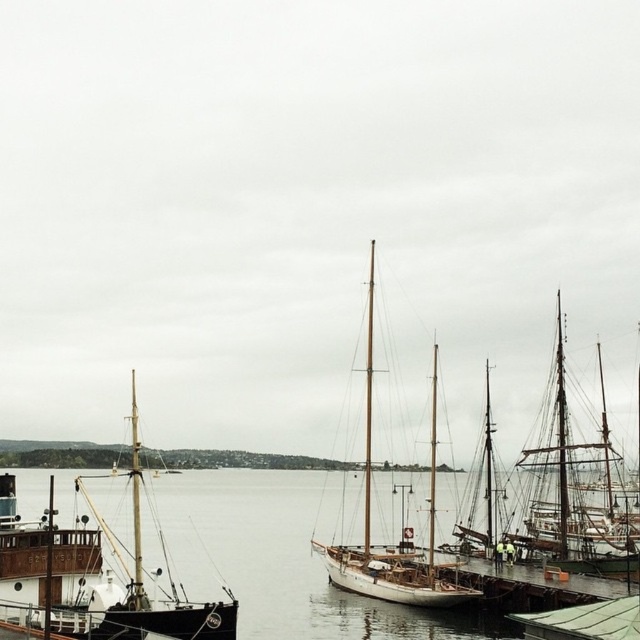
Question: Does clear water at center appear under dark brown wooden ship at left?

Choices:
 (A) no
 (B) yes

Answer: (B)

Question: Which of the following is the farthest from the observer?

Choices:
 (A) white wooden sailboat at center
 (B) dark brown wooden ship at left

Answer: (A)

Question: Estimate the real-world distances between objects in this image. Which object is farther from the white wooden sailboat at center?

Choices:
 (A) dark brown wooden ship at left
 (B) clear water at center

Answer: (A)

Question: Based on their relative distances, which object is nearer to the clear water at center?

Choices:
 (A) dark brown wooden ship at left
 (B) white wooden sailboat at center

Answer: (B)

Question: Is clear water at center wider than white wooden sailboat at center?

Choices:
 (A) yes
 (B) no

Answer: (A)

Question: Can you confirm if dark brown wooden ship at left is bigger than white wooden sailboat at center?

Choices:
 (A) yes
 (B) no

Answer: (B)